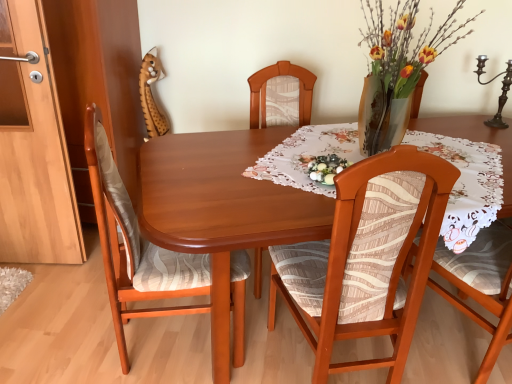
Locate an element on the screen. Image resolution: width=512 pixels, height=384 pixels. wooden chair at left, which is the second chair in right-to-left order is located at coordinates (137, 246).

The image size is (512, 384). I want to click on floral lace tablecloth at center, so click(x=466, y=185).

Describe the element at coordinates (500, 95) in the screenshot. I see `polished dark brown candle holder at upper right` at that location.

This screenshot has width=512, height=384. I want to click on polished dark brown candle holder at upper right, so (500, 95).

The height and width of the screenshot is (384, 512). I want to click on wooden chair at left, arranged as the first chair when viewed from the left, so click(137, 246).

Is polished dark brown candle holder at upper right looking in the opposite direction of floral lace tablecloth at center?

No, floral lace tablecloth at center is not at the back of polished dark brown candle holder at upper right.

From a real-world perspective, does polished dark brown candle holder at upper right sit lower than floral lace tablecloth at center?

No, from a real-world perspective, polished dark brown candle holder at upper right is not under floral lace tablecloth at center.

Is point (506, 91) positioned behind point (297, 162)?

Yes.

Considering the sizes of polished dark brown candle holder at upper right and floral lace tablecloth at center in the image, is polished dark brown candle holder at upper right wider or thinner than floral lace tablecloth at center?

Clearly, polished dark brown candle holder at upper right has less width compared to floral lace tablecloth at center.

Considering the relative sizes of matte wood cabinet at left and polished dark brown candle holder at upper right in the image provided, is matte wood cabinet at left taller than polished dark brown candle holder at upper right?

Yes.

Is matte wood cabinet at left positioned far away from polished dark brown candle holder at upper right?

Yes, matte wood cabinet at left and polished dark brown candle holder at upper right are located far from each other.

Which object is closer to the camera, matte wood cabinet at left or polished dark brown candle holder at upper right?

Positioned in front is polished dark brown candle holder at upper right.

Would you say matte wood cabinet at left is outside polished dark brown candle holder at upper right?

matte wood cabinet at left is positioned outside polished dark brown candle holder at upper right.

From a real-world perspective, relative to wooden chair at left, which is the second chair in right-to-left order, is polished dark brown candle holder at upper right vertically above or below?

Clearly, from a real-world perspective, polished dark brown candle holder at upper right is above wooden chair at left, which is the second chair in right-to-left order.

Looking at this image, can you confirm if polished dark brown candle holder at upper right is bigger than wooden chair at left, which is the second chair in right-to-left order?

Incorrect, polished dark brown candle holder at upper right is not larger than wooden chair at left, which is the second chair in right-to-left order.

In the scene shown: Based on their positions, is polished dark brown candle holder at upper right located to the left or right of wooden chair at left, arranged as the first chair when viewed from the left?

polished dark brown candle holder at upper right is to the right of wooden chair at left, arranged as the first chair when viewed from the left.

Which object is closer to the camera, polished dark brown candle holder at upper right or wooden chair at left, arranged as the first chair when viewed from the left?

wooden chair at left, arranged as the first chair when viewed from the left.

Is floral lace tablecloth at center oriented away from matte wood cabinet at left?

That's not correct — floral lace tablecloth at center is not looking away from matte wood cabinet at left.

Does floral lace tablecloth at center have a greater height compared to matte wood cabinet at left?

Incorrect, the height of floral lace tablecloth at center is not larger of that of matte wood cabinet at left.

From a real-world perspective, is floral lace tablecloth at center located higher than matte wood cabinet at left?

Yes, from a real-world perspective, floral lace tablecloth at center is above matte wood cabinet at left.

Which object is positioned more to the left, floral lace tablecloth at center or matte wood cabinet at left?

Positioned to the left is matte wood cabinet at left.

Considering the relative sizes of wooden chair with patterned fabric at center, which is counted as the second chair, starting from the left, and polished dark brown candle holder at upper right in the image provided, is wooden chair with patterned fabric at center, which is counted as the second chair, starting from the left, thinner than polished dark brown candle holder at upper right?

In fact, wooden chair with patterned fabric at center, which is counted as the second chair, starting from the left, might be wider than polished dark brown candle holder at upper right.

Which object is positioned more to the right, wooden chair with patterned fabric at center, positioned as the 1th chair in right-to-left order, or polished dark brown candle holder at upper right?

From the viewer's perspective, polished dark brown candle holder at upper right appears more on the right side.

Between wooden chair with patterned fabric at center, which is counted as the second chair, starting from the left, and polished dark brown candle holder at upper right, which one has less height?

polished dark brown candle holder at upper right.

Can we say wooden chair with patterned fabric at center, which is counted as the second chair, starting from the left, lies outside polished dark brown candle holder at upper right?

Yes, wooden chair with patterned fabric at center, which is counted as the second chair, starting from the left, is outside of polished dark brown candle holder at upper right.

Is point (257, 174) closer or farther from the camera than point (219, 157)?

Point (257, 174) appears to be closer to the viewer than point (219, 157).

From the picture: Are floral lace tablecloth at center and mahogany wood table at center beside each other?

No, floral lace tablecloth at center is not beside mahogany wood table at center.

Can you tell me how much floral lace tablecloth at center and mahogany wood table at center differ in facing direction?

68.4 degrees separate the facing orientations of floral lace tablecloth at center and mahogany wood table at center.

Measure the distance between floral lace tablecloth at center and mahogany wood table at center.

floral lace tablecloth at center and mahogany wood table at center are 27.88 inches apart.

Is wooden chair at left, which is the second chair in right-to-left order, with floral lace tablecloth at center?

No, wooden chair at left, which is the second chair in right-to-left order, is not beside floral lace tablecloth at center.

How different are the orientations of wooden chair at left, which is the second chair in right-to-left order, and floral lace tablecloth at center in degrees?

They differ by 134 degrees in their facing directions.

Does point (233, 326) come closer to viewer compared to point (464, 180)?

No, it is behind (464, 180).

The width and height of the screenshot is (512, 384). I want to click on tablecloth below the polished dark brown candle holder at upper right (from a real-world perspective), so click(x=466, y=185).

Locate an element on the screen. The width and height of the screenshot is (512, 384). candle holder above the matte wood cabinet at left (from the image's perspective) is located at coordinates (500, 95).

Estimate the real-world distances between objects in this image. Which object is further from matte wood cabinet at left, polished dark brown candle holder at upper right or floral lace tablecloth at center?

Among the two, polished dark brown candle holder at upper right is located further to matte wood cabinet at left.

Estimate the real-world distances between objects in this image. Which object is closer to matte wood cabinet at left, wooden chair at left, arranged as the first chair when viewed from the left, or polished dark brown candle holder at upper right?

Among the two, wooden chair at left, arranged as the first chair when viewed from the left, is located nearer to matte wood cabinet at left.

From the image, which object appears to be farther from polished dark brown candle holder at upper right, floral lace tablecloth at center or matte wood cabinet at left?

Based on the image, matte wood cabinet at left appears to be further to polished dark brown candle holder at upper right.

From the image, which object appears to be nearer to wooden chair at left, which is the second chair in right-to-left order, polished dark brown candle holder at upper right or floral lace tablecloth at center?

The object closer to wooden chair at left, which is the second chair in right-to-left order, is floral lace tablecloth at center.

Estimate the real-world distances between objects in this image. Which object is further from matte wood cabinet at left, polished dark brown candle holder at upper right or wooden chair at left, arranged as the first chair when viewed from the left?

Based on the image, polished dark brown candle holder at upper right appears to be further to matte wood cabinet at left.

Which object lies nearer to the anchor point matte wood cabinet at left, mahogany wood table at center or wooden chair at left, arranged as the first chair when viewed from the left?

mahogany wood table at center is positioned closer to the anchor matte wood cabinet at left.

Which object lies further to the anchor point matte wood cabinet at left, floral lace tablecloth at center or wooden chair at left, arranged as the first chair when viewed from the left?

Based on the image, floral lace tablecloth at center appears to be further to matte wood cabinet at left.

Considering their positions, is wooden chair with patterned fabric at center, which is counted as the second chair, starting from the left, positioned closer to wooden chair at left, which is the second chair in right-to-left order, than matte wood cabinet at left?

The object closer to wooden chair at left, which is the second chair in right-to-left order, is wooden chair with patterned fabric at center, which is counted as the second chair, starting from the left.

At what (x,y) coordinates should I click in order to perform the action: click on tablecloth located between wooden chair at left, arranged as the first chair when viewed from the left, and polished dark brown candle holder at upper right in the left-right direction. Please return your answer as a coordinate pair (x, y). This screenshot has width=512, height=384. Looking at the image, I should click on (466, 185).

The width and height of the screenshot is (512, 384). Identify the location of kitchen & dining room table between wooden chair at left, arranged as the first chair when viewed from the left, and floral lace tablecloth at center from left to right. (222, 208).

The image size is (512, 384). In order to click on chair located between mahogany wood table at center and polished dark brown candle holder at upper right in the left-right direction in this screenshot , I will do click(x=367, y=255).

Where is `chair between mahogany wood table at center and floral lace tablecloth at center in the horizontal direction`? This screenshot has height=384, width=512. chair between mahogany wood table at center and floral lace tablecloth at center in the horizontal direction is located at coordinates (367, 255).